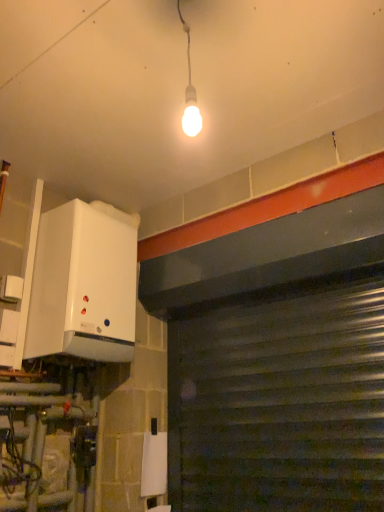
Identify the location of white matte boiler at left. (84, 284).

Describe the element at coordinates (84, 284) in the screenshot. Image resolution: width=384 pixels, height=512 pixels. I see `white matte boiler at left` at that location.

Image resolution: width=384 pixels, height=512 pixels. Describe the element at coordinates (280, 399) in the screenshot. I see `metallic gray garage door at lower right` at that location.

What is the approximate width of metallic gray garage door at lower right?

It is 2.57 inches.

Where is `metallic gray garage door at lower right`? This screenshot has width=384, height=512. metallic gray garage door at lower right is located at coordinates (280, 399).

The height and width of the screenshot is (512, 384). What are the coordinates of `white matte boiler at left` in the screenshot? It's located at (84, 284).

Considering the relative positions of metallic gray garage door at lower right and white matte boiler at left in the image provided, is metallic gray garage door at lower right to the left or to the right of white matte boiler at left?

Based on their positions, metallic gray garage door at lower right is located to the right of white matte boiler at left.

Is metallic gray garage door at lower right in front of white matte boiler at left?

Yes, the depth of metallic gray garage door at lower right is less than that of white matte boiler at left.

Considering the points (173, 393) and (97, 209), which point is in front, point (173, 393) or point (97, 209)?

The point (97, 209) is closer to the camera.

From the image's perspective, is metallic gray garage door at lower right positioned above or below white matte boiler at left?

Based on their image positions, metallic gray garage door at lower right is located beneath white matte boiler at left.

From a real-world perspective, is metallic gray garage door at lower right over white matte boiler at left?

Incorrect, from a real-world perspective, metallic gray garage door at lower right is lower than white matte boiler at left.

Considering the relative sizes of metallic gray garage door at lower right and white matte boiler at left in the image provided, is metallic gray garage door at lower right thinner than white matte boiler at left?

Correct, the width of metallic gray garage door at lower right is less than that of white matte boiler at left.

Is metallic gray garage door at lower right taller than white matte boiler at left?

Correct, metallic gray garage door at lower right is much taller as white matte boiler at left.

Who is bigger, metallic gray garage door at lower right or white matte boiler at left?

With larger size is white matte boiler at left.

Looking at this image, is white matte boiler at left inside metallic gray garage door at lower right?

No, white matte boiler at left is not surrounded by metallic gray garage door at lower right.

Is metallic gray garage door at lower right far away from white matte boiler at left?

metallic gray garage door at lower right is actually quite close to white matte boiler at left.

Could you tell me if metallic gray garage door at lower right is turned towards white matte boiler at left?

Yes, metallic gray garage door at lower right is aimed at white matte boiler at left.

Looking at this image, how many degrees apart are the facing directions of metallic gray garage door at lower right and white matte boiler at left?

They differ by 88 degrees in their facing directions.

In the image, there is a white matte boiler at left. Where is `garage door below it (from a real-world perspective)`? The height and width of the screenshot is (512, 384). garage door below it (from a real-world perspective) is located at coordinates (280, 399).

Based on the photo, considering the relative positions of white matte boiler at left and metallic gray garage door at lower right in the image provided, is white matte boiler at left to the left of metallic gray garage door at lower right from the viewer's perspective?

Correct, you'll find white matte boiler at left to the left of metallic gray garage door at lower right.

Relative to metallic gray garage door at lower right, is white matte boiler at left in front or behind?

white matte boiler at left is positioned farther from the viewer than metallic gray garage door at lower right.

Which is more distant, (x=25, y=351) or (x=217, y=307)?

The point (x=217, y=307) is farther.

From the image's perspective, between white matte boiler at left and metallic gray garage door at lower right, who is located below?

metallic gray garage door at lower right appears lower in the image.

From a real-world perspective, is white matte boiler at left below metallic gray garage door at lower right?

Incorrect, from a real-world perspective, white matte boiler at left is higher than metallic gray garage door at lower right.

Is white matte boiler at left wider than metallic gray garage door at lower right?

Yes, white matte boiler at left is wider than metallic gray garage door at lower right.

Between white matte boiler at left and metallic gray garage door at lower right, which one has more height?

With more height is metallic gray garage door at lower right.

Based on their sizes in the image, would you say white matte boiler at left is bigger or smaller than metallic gray garage door at lower right?

white matte boiler at left is bigger than metallic gray garage door at lower right.

Is white matte boiler at left spatially inside metallic gray garage door at lower right, or outside of it?

The correct answer is: outside.

Is white matte boiler at left in contact with metallic gray garage door at lower right?

white matte boiler at left is not next to metallic gray garage door at lower right, and they're not touching.

In the scene shown: Is white matte boiler at left looking in the opposite direction of metallic gray garage door at lower right?

That's not correct — white matte boiler at left is not looking away from metallic gray garage door at lower right.

How different are the orientations of white matte boiler at left and metallic gray garage door at lower right in degrees?

88 degrees.

Identify the location of garage door that is below the white matte boiler at left (from the image's perspective). (280, 399).

The image size is (384, 512). What are the coordinates of `garage door located on the right of white matte boiler at left` in the screenshot? It's located at (280, 399).

Where is `garage door below the white matte boiler at left (from the image's perspective)`? This screenshot has width=384, height=512. garage door below the white matte boiler at left (from the image's perspective) is located at coordinates (280, 399).